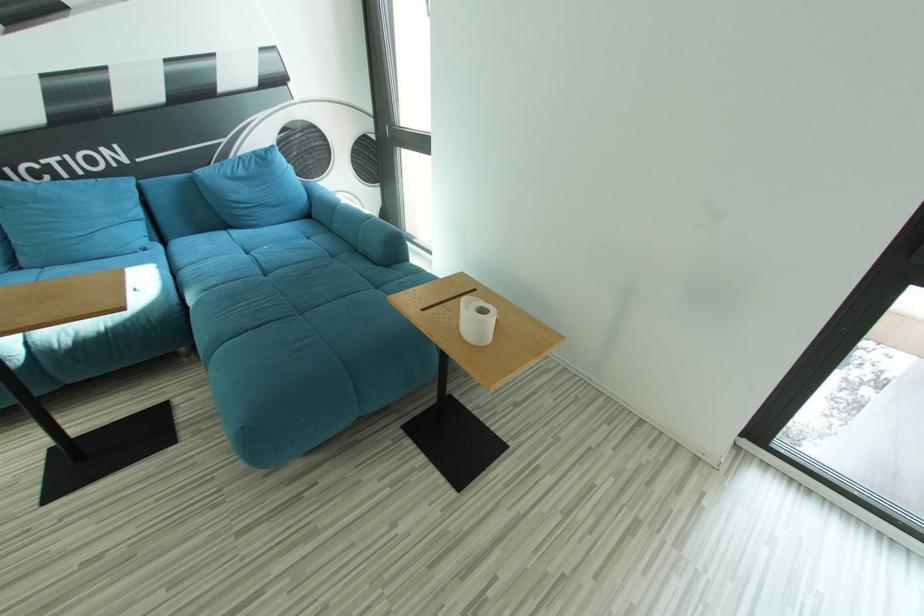
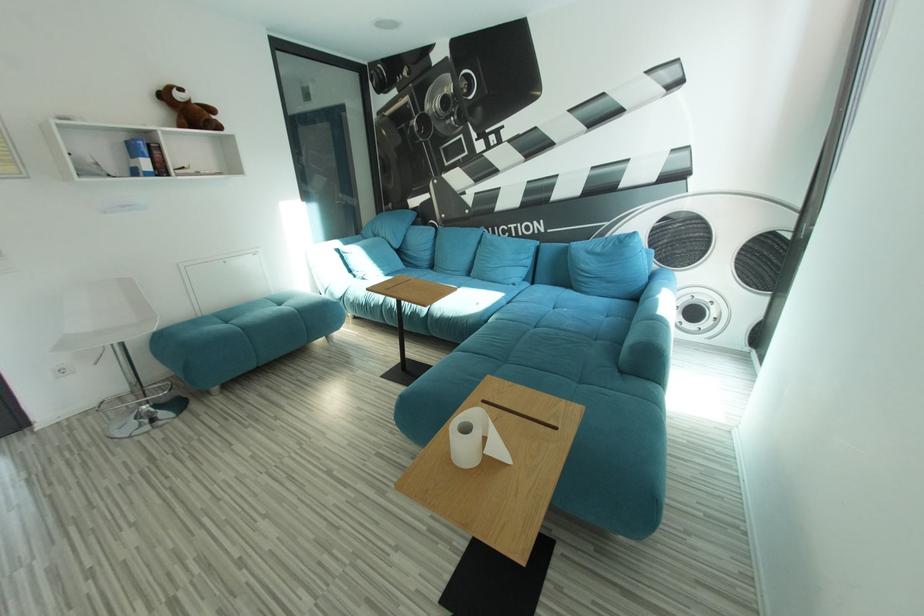
Question: Based on the continuous images, in which direction is the camera rotating? Reply with the corresponding letter.

Choices:
 (A) Left
 (B) Right
 (C) Up
 (D) Down

Answer: (A)